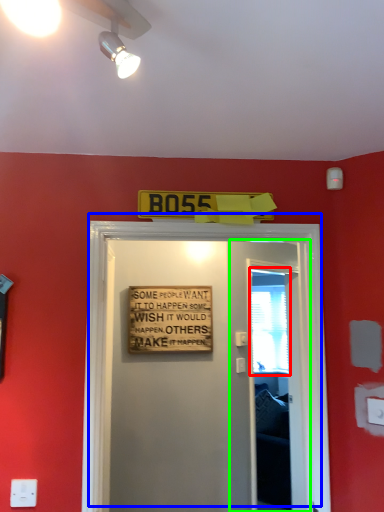
Question: Based on their relative distances, which object is farther from window screen (highlighted by a red box)? Choose from door (highlighted by a blue box) and screen door (highlighted by a green box).

Choices:
 (A) door
 (B) screen door

Answer: (A)